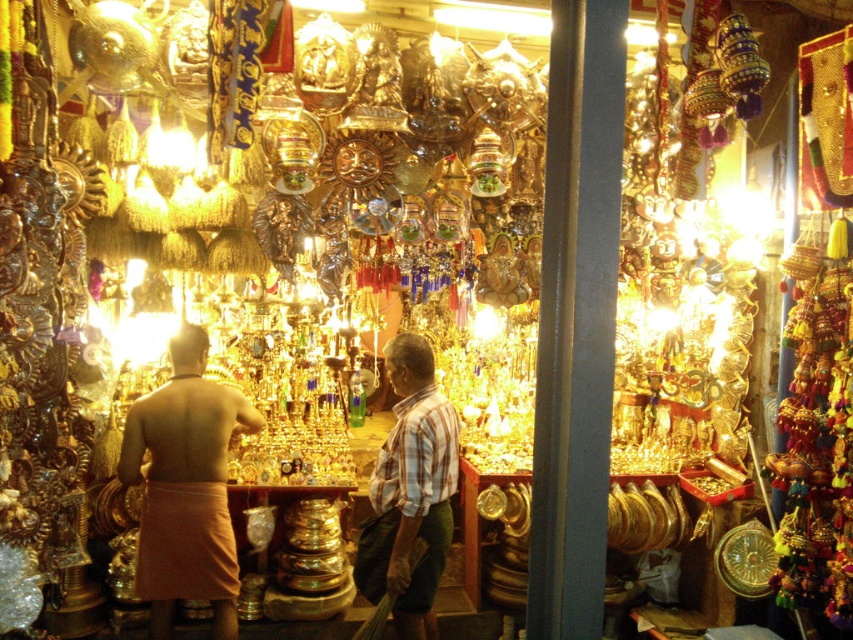
You are a customer at the market stall and want to purchase both the orange fabric cloth at center and the plaid fabric shirt at center. The vendor requires you to stack them vertically for packing. Which item should you place at the bottom to ensure stability?

The orange fabric cloth at center has a lesser height compared to plaid fabric shirt at center. Therefore, you should place the plaid fabric shirt at center at the bottom to ensure stability.

You are a customer at the market stall. You want to buy the orange fabric cloth at center. Where exactly should you look to find it?

The orange fabric cloth at center is located at point (x=184, y=486).